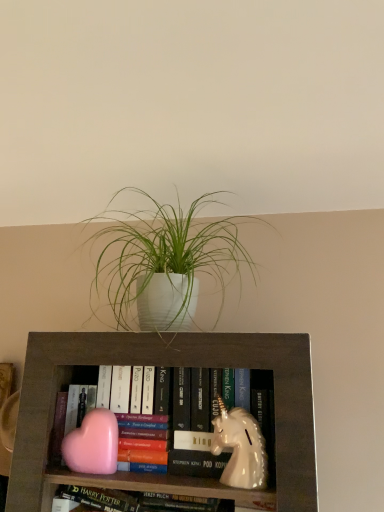
Question: Does white matte plant pot at upper center have a greater width compared to pink matte heart at lower left, the second animal in the right-to-left sequence?

Choices:
 (A) no
 (B) yes

Answer: (B)

Question: Would you consider white matte plant pot at upper center to be distant from pink matte heart at lower left, the first animal positioned from the left?

Choices:
 (A) no
 (B) yes

Answer: (A)

Question: Considering the relative positions of white matte plant pot at upper center and pink matte heart at lower left, the second animal in the right-to-left sequence, in the image provided, is white matte plant pot at upper center behind pink matte heart at lower left, the second animal in the right-to-left sequence,?

Choices:
 (A) yes
 (B) no

Answer: (B)

Question: From a real-world perspective, is white matte plant pot at upper center physically above pink matte heart at lower left, the first animal positioned from the left?

Choices:
 (A) yes
 (B) no

Answer: (A)

Question: Is white matte plant pot at upper center not inside pink matte heart at lower left, the second animal in the right-to-left sequence?

Choices:
 (A) yes
 (B) no

Answer: (A)

Question: In the image, is pink matte heart at lower left, the first animal positioned from the left, positioned in front of or behind white glossy unicorn at center, the 1th animal viewed from the right?

Choices:
 (A) behind
 (B) front

Answer: (A)

Question: Looking at their shapes, would you say pink matte heart at lower left, the first animal positioned from the left, is wider or thinner than white glossy unicorn at center, the 1th animal viewed from the right?

Choices:
 (A) thin
 (B) wide

Answer: (A)

Question: From the image's perspective, is pink matte heart at lower left, the first animal positioned from the left, positioned above or below white glossy unicorn at center, the 1th animal viewed from the right?

Choices:
 (A) below
 (B) above

Answer: (A)

Question: Is pink matte heart at lower left, the first animal positioned from the left, situated inside white glossy unicorn at center, which is counted as the second animal, starting from the left, or outside?

Choices:
 (A) inside
 (B) outside

Answer: (B)

Question: From a real-world perspective, relative to white matte plant pot at upper center, is pink matte heart at lower left, the second animal in the right-to-left sequence, vertically above or below?

Choices:
 (A) above
 (B) below

Answer: (B)

Question: Is pink matte heart at lower left, the second animal in the right-to-left sequence, wider or thinner than white matte plant pot at upper center?

Choices:
 (A) thin
 (B) wide

Answer: (A)

Question: In terms of size, does pink matte heart at lower left, the first animal positioned from the left, appear bigger or smaller than white matte plant pot at upper center?

Choices:
 (A) big
 (B) small

Answer: (B)

Question: From the image's perspective, is pink matte heart at lower left, the second animal in the right-to-left sequence, positioned above or below white matte plant pot at upper center?

Choices:
 (A) above
 (B) below

Answer: (B)

Question: Considering their positions, is white glossy unicorn at center, the 1th animal viewed from the right, located in front of or behind white matte plant pot at upper center?

Choices:
 (A) behind
 (B) front

Answer: (A)

Question: Considering the positions of white glossy unicorn at center, the 1th animal viewed from the right, and white matte plant pot at upper center in the image, is white glossy unicorn at center, the 1th animal viewed from the right, bigger or smaller than white matte plant pot at upper center?

Choices:
 (A) small
 (B) big

Answer: (A)